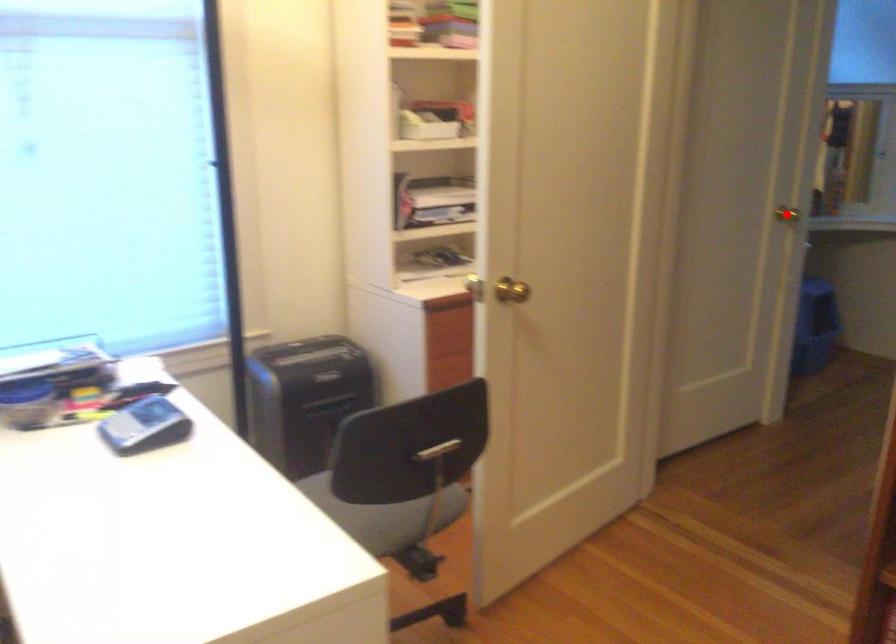
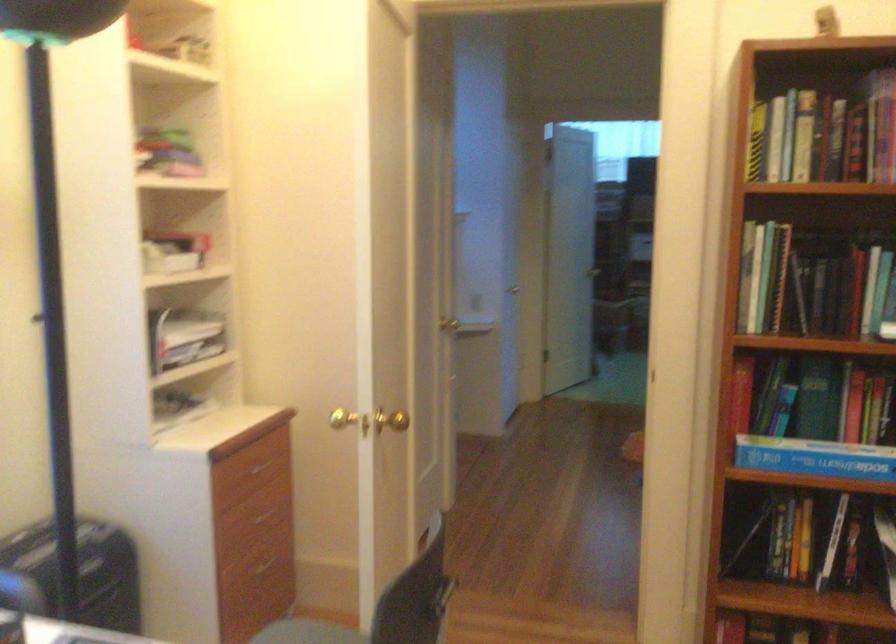
The point at the highlighted location is marked in the first image. Where is the corresponding point in the second image?

(455, 321)